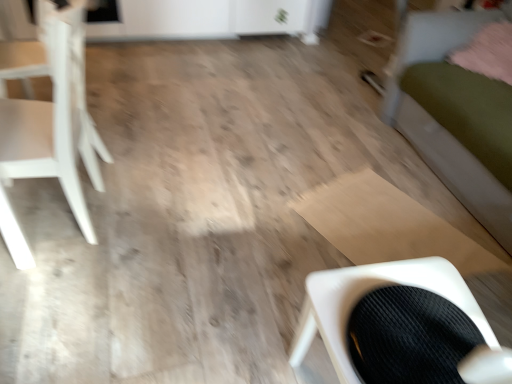
Question: Considering their positions, is white matte chair at left, the 2th chair from the bottom, located in front of or behind black corduroy chair at lower right, positioned as the first chair in right-to-left order?

Choices:
 (A) behind
 (B) front

Answer: (A)

Question: Is white matte chair at left, placed as the first chair when sorted from left to right, to the left or to the right of black corduroy chair at lower right, which is the second chair in left-to-right order, in the image?

Choices:
 (A) left
 (B) right

Answer: (A)

Question: Estimate the real-world distances between objects in this image. Which object is farther from the white matte chair at left, which appears as the first chair when viewed from the top?

Choices:
 (A) pink fluffy pillow at upper right
 (B) green fabric bed at right
 (C) black corduroy chair at lower right, acting as the 1th chair starting from the bottom

Answer: (A)

Question: Which of these objects is positioned farthest from the green fabric bed at right?

Choices:
 (A) pink fluffy pillow at upper right
 (B) black corduroy chair at lower right, positioned as the 2th chair in back-to-front order
 (C) white matte chair at left, acting as the 2th chair starting from the right

Answer: (C)